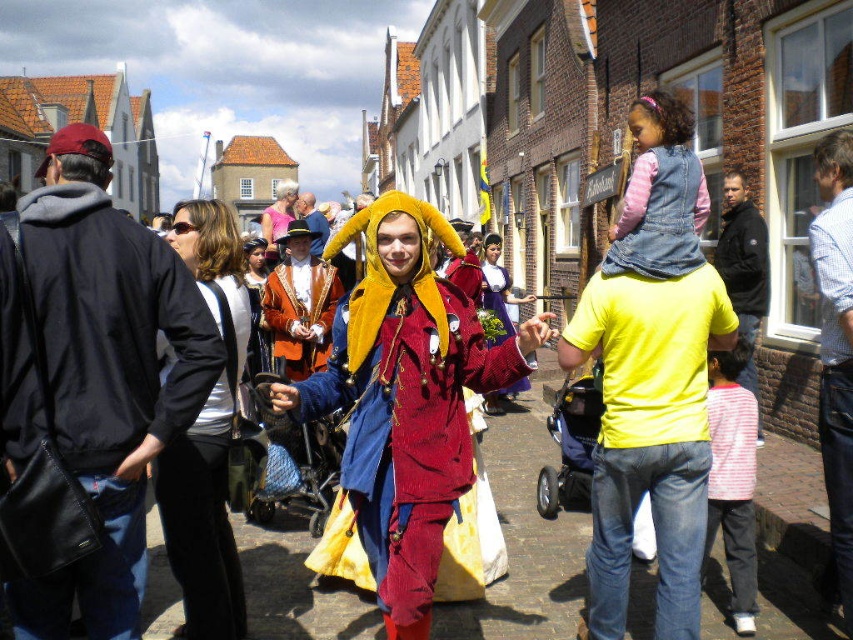
Question: Which point appears farthest from the camera in this image?

Choices:
 (A) (682, 305)
 (B) (619, 221)
 (C) (320, 248)
 (D) (750, 225)

Answer: (C)

Question: Does denim vest at upper right lie behind leather jacket at center?

Choices:
 (A) yes
 (B) no

Answer: (B)

Question: Does denim vest at upper right have a lesser width compared to velvet purple dress at center?

Choices:
 (A) no
 (B) yes

Answer: (B)

Question: Which object is closer to the camera taking this photo?

Choices:
 (A) striped cotton shirt at lower right
 (B) matte pink dress at center

Answer: (A)

Question: Which point appears farthest from the camera in this image?

Choices:
 (A) [726, 189]
 (B) [747, 554]
 (C) [323, 358]
 (D) [160, 406]

Answer: (C)

Question: Is velvet maroon robe at center thinner than velvet gold hat at center?

Choices:
 (A) yes
 (B) no

Answer: (B)